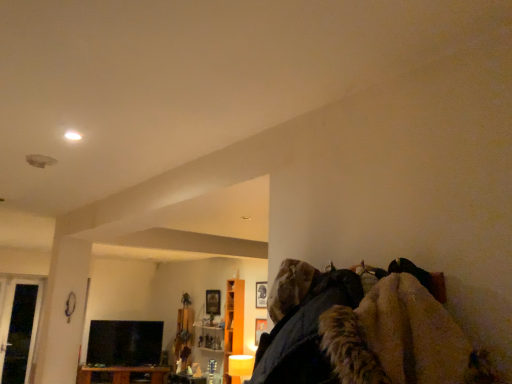
Question: Considering the positions of black glossy tv at lower left and brown wood cabinet at lower left in the image, is black glossy tv at lower left taller or shorter than brown wood cabinet at lower left?

Choices:
 (A) tall
 (B) short

Answer: (A)

Question: Visually, is black glossy tv at lower left positioned to the left or to the right of brown wood cabinet at lower left?

Choices:
 (A) right
 (B) left

Answer: (B)

Question: Considering the real-world distances, which object is closest to the orange wood cabinet at center?

Choices:
 (A) transparent glass door at left
 (B) black glossy tv at lower left
 (C) brown wood cabinet at lower left

Answer: (C)

Question: Which of these objects is positioned closest to the transparent glass door at left?

Choices:
 (A) orange wood cabinet at center
 (B) brown wood cabinet at lower left
 (C) black glossy tv at lower left

Answer: (B)